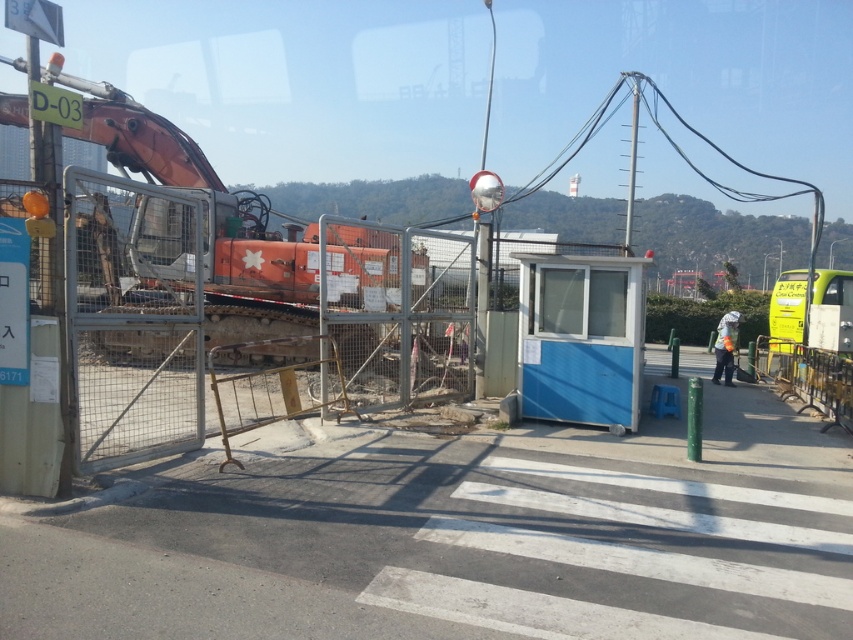
Based on the photo, is orange metallic excavator at left to the right of reflective orange vest at center from the viewer's perspective?

No, orange metallic excavator at left is not to the right of reflective orange vest at center.

Does orange metallic excavator at left lie behind reflective orange vest at center?

No.

Is point (292, 248) behind point (729, 326)?

No, it is not.

Identify the location of orange metallic excavator at left. The image size is (853, 640). (212, 218).

Is point (573, 346) farther from viewer compared to point (732, 342)?

No, (573, 346) is closer to viewer.

Who is shorter, blue plastic booth at center or reflective orange vest at center?

Standing shorter between the two is reflective orange vest at center.

Is point (554, 304) closer to camera compared to point (720, 362)?

Yes, it is.

Identify the location of blue plastic booth at center. (579, 337).

Is orange metallic excavator at left closer to camera compared to blue plastic booth at center?

Yes, it is.

Find the location of a particular element. This screenshot has height=640, width=853. orange metallic excavator at left is located at coordinates (212, 218).